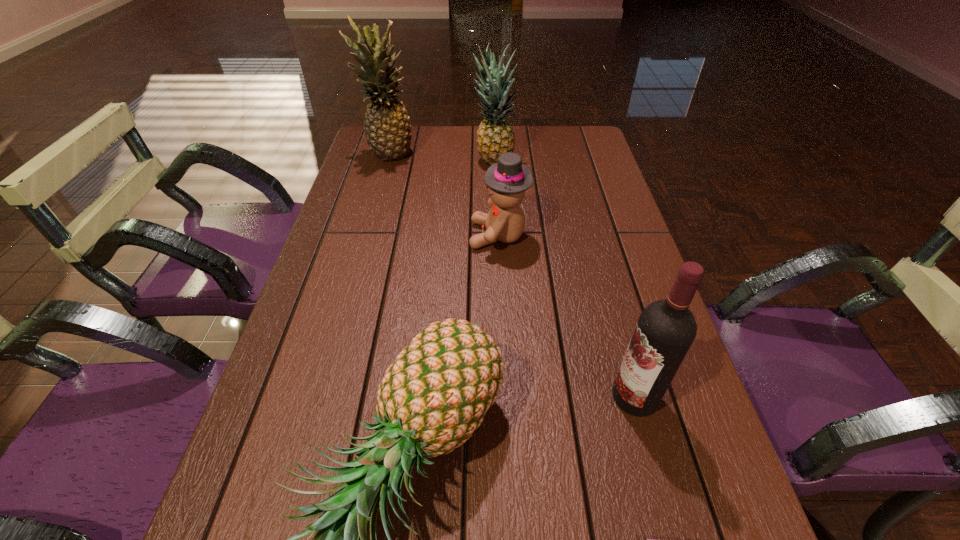
Identify the location of object positioned at the left edge. This screenshot has width=960, height=540. (387, 128).

Where is `object present at the right edge`? The image size is (960, 540). object present at the right edge is located at coordinates (666, 329).

Where is `object positioned at the far left corner`? object positioned at the far left corner is located at coordinates (387, 128).

The image size is (960, 540). What are the coordinates of `free space at the far edge of the desktop` in the screenshot? It's located at (523, 161).

Where is `vacant space at the left edge`? vacant space at the left edge is located at coordinates (383, 253).

Locate an element on the screen. Image resolution: width=960 pixels, height=540 pixels. vacant position at the right edge of the desktop is located at coordinates (615, 251).

This screenshot has width=960, height=540. Identify the location of vacant space at the far left corner. (365, 152).

What are the coordinates of `free space between the wine bottle and the second shortest pineapple` in the screenshot? It's located at (564, 280).

Locate which object ranks second in proximity to the shortest pineapple. Please provide its 2D coordinates. Your answer should be formatted as a tuple, i.e. [(x, y)], where the tuple contains the x and y coordinates of a point satisfying the conditions above.

[(666, 329)]

The image size is (960, 540). I want to click on object that can be found as the closest to the shortest object, so click(x=666, y=329).